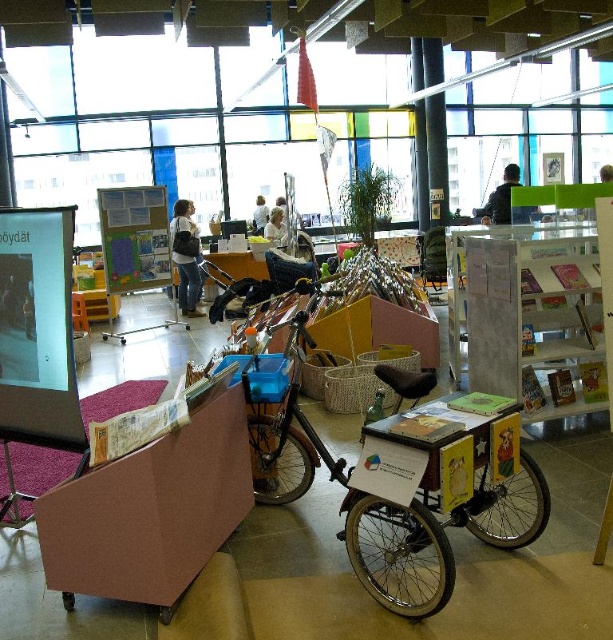
You are standing in the library and looking at the tricycle. There are two points marked on the tricycle. The first point is at coordinates point (x=191, y=310) and the second point is at coordinates point (x=603, y=177). Which point appears closer to you?

Point (x=191, y=310) is closer to the camera than point (x=603, y=177), so the first point appears closer to you.

You are a visitor in the library and notice two items in the image. One is a denim jacket at center and the other is a blonde hair at upper center. Which one is positioned lower in the image?

The denim jacket at center is positioned below the blonde hair at upper center, so the denim jacket at center is lower.